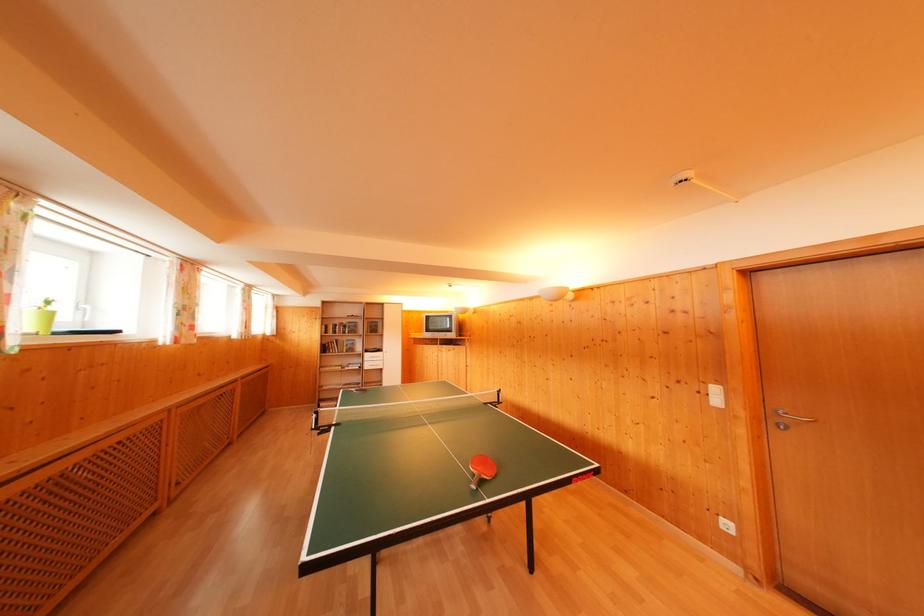
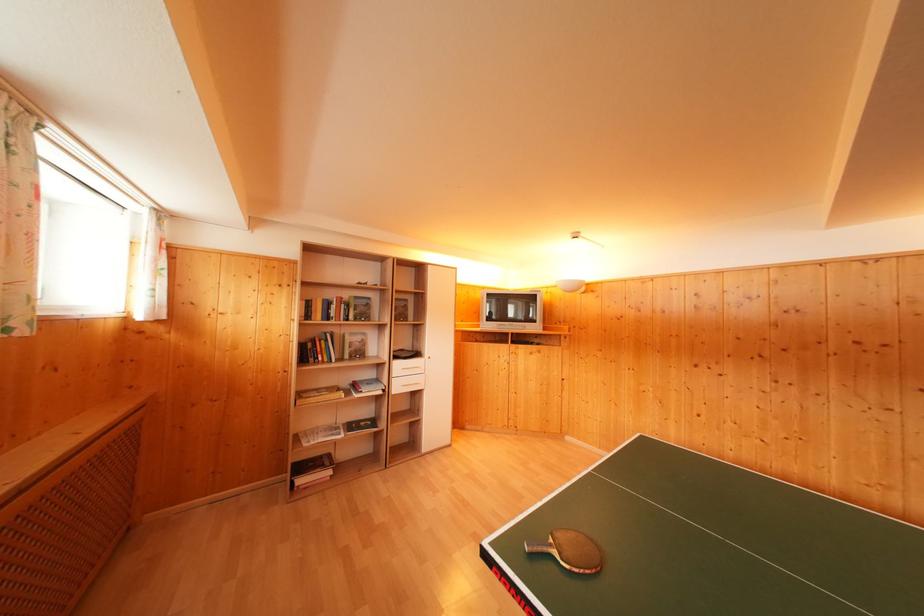
Which direction would the cameraman need to move to produce the second image?

The cameraman walked toward left, forward.